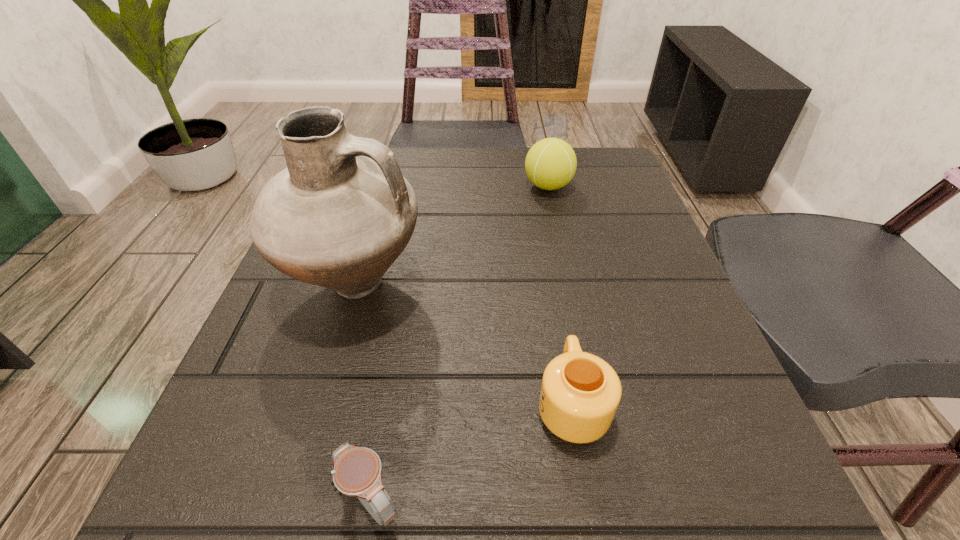
You are a GUI agent. You are given a task and a screenshot of the screen. Output one action in this format:
    pyautogui.click(x=<x>, y=<y>)
    Task: Click on the vacant space at the right edge of the desktop
    This screenshot has height=540, width=960.
    Given the screenshot: What is the action you would take?
    pyautogui.click(x=620, y=259)

Where is `free space at the near left corner`? Image resolution: width=960 pixels, height=540 pixels. free space at the near left corner is located at coordinates (225, 457).

Image resolution: width=960 pixels, height=540 pixels. Find the location of `free space at the near right corner of the desktop`. free space at the near right corner of the desktop is located at coordinates (684, 481).

Where is `free space between the mug and the farthest object`? The image size is (960, 540). free space between the mug and the farthest object is located at coordinates (560, 295).

At what (x,y) coordinates should I click in order to perform the action: click on empty space between the tallest object and the mug. Please return your answer as a coordinate pair (x, y). Looking at the image, I should click on (464, 345).

What are the coordinates of `empty space that is in between the tennis ball and the third nearest object` in the screenshot? It's located at (452, 236).

At what (x,y) coordinates should I click in order to perform the action: click on free space between the second nearest object and the watch. Please return your answer as a coordinate pair (x, y). Looking at the image, I should click on (471, 453).

What are the coordinates of `vacant space that's between the tallest object and the second nearest object` in the screenshot? It's located at (464, 345).

The width and height of the screenshot is (960, 540). I want to click on vacant area that lies between the nearest object and the third nearest object, so click(363, 394).

The image size is (960, 540). In order to click on free area in between the nearest object and the farthest object in this screenshot , I will do `click(460, 344)`.